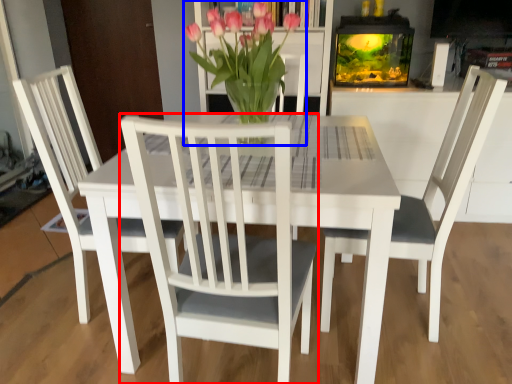
Question: Which object appears farthest to the camera in this image, chair (highlighted by a red box) or houseplant (highlighted by a blue box)?

Choices:
 (A) chair
 (B) houseplant

Answer: (B)